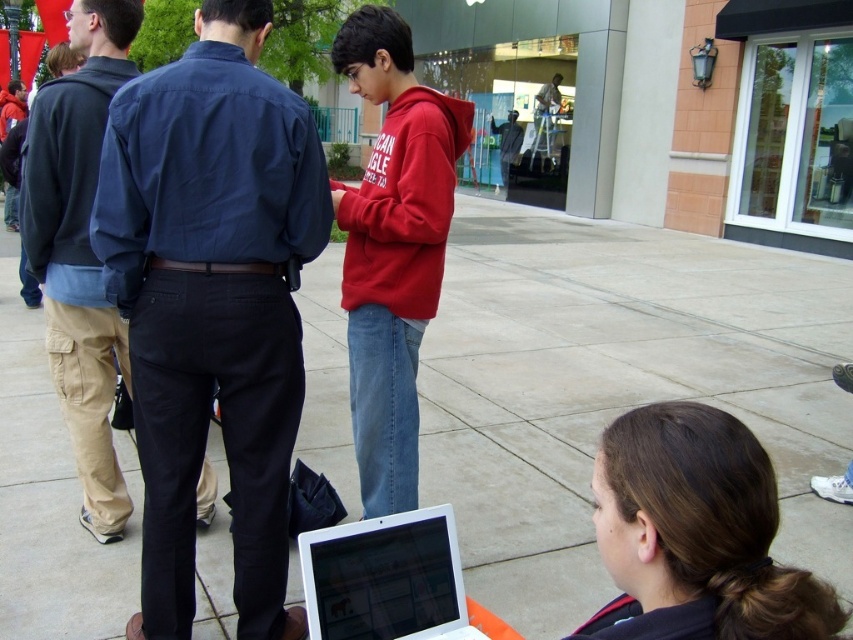
Question: Which of the following is the closest to the observer?

Choices:
 (A) khaki cargo pants at left
 (B) red fleece hoodie at center
 (C) dark blue shirt at center
 (D) brown hair at lower right

Answer: (D)

Question: Which object appears farthest from the camera in this image?

Choices:
 (A) dark blue shirt at center
 (B) red fleece hoodie at center
 (C) khaki cargo pants at left
 (D) smooth concrete pavement at center

Answer: (C)

Question: Is dark blue shirt at center positioned at the back of red fleece hoodie at center?

Choices:
 (A) yes
 (B) no

Answer: (B)

Question: Is dark blue shirt at center positioned behind brown hair at lower right?

Choices:
 (A) no
 (B) yes

Answer: (B)

Question: Which point appears closest to the camera in this image?

Choices:
 (A) (432, 584)
 (B) (115, 54)

Answer: (A)

Question: Is brown hair at lower right smaller than khaki cargo pants at left?

Choices:
 (A) yes
 (B) no

Answer: (A)